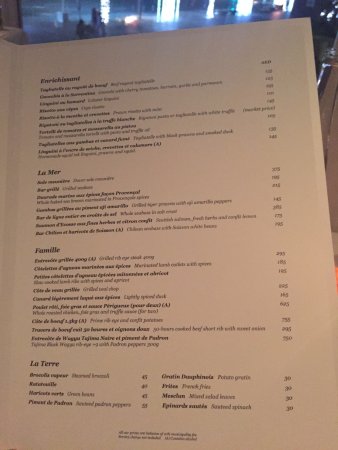
At what (x,y) coordinates should I click in order to perform the action: click on window in the background. Please return your answer as a coordinate pair (x, y). The image size is (338, 450). Looking at the image, I should click on (167, 13).